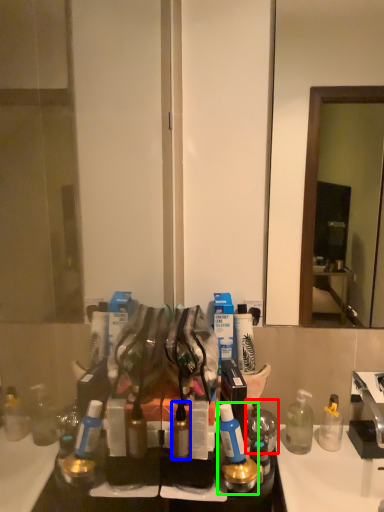
Question: Which object is positioned farthest from toiletry (highlighted by a red box)? Select from toiletry (highlighted by a blue box) and toiletry (highlighted by a green box).

Choices:
 (A) toiletry
 (B) toiletry

Answer: (A)